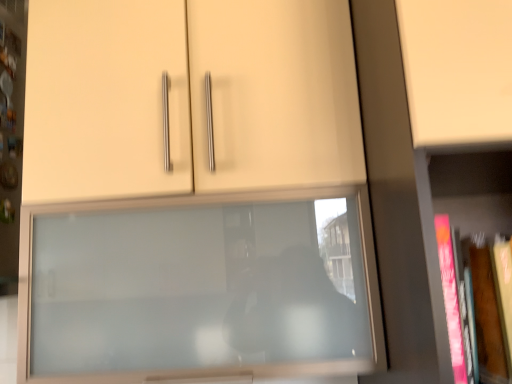
What do you see at coordinates (192, 194) in the screenshot? I see `matte glass cupboard at center` at bounding box center [192, 194].

Where is `matte glass cupboard at center`? matte glass cupboard at center is located at coordinates click(192, 194).

Considering the sizes of objects matte glass cupboard at center and pink matte book at right in the image provided, who is wider, matte glass cupboard at center or pink matte book at right?

With larger width is pink matte book at right.

From the image's perspective, is matte glass cupboard at center on pink matte book at right?

No, from the image's perspective, matte glass cupboard at center is not above pink matte book at right.

Would you say matte glass cupboard at center is outside pink matte book at right?

Yes, matte glass cupboard at center is not within pink matte book at right.

At what (x,y) coordinates should I click in order to perform the action: click on bookcase in front of the matte glass cupboard at center. Please return your answer as a coordinate pair (x, y). Image resolution: width=512 pixels, height=384 pixels. Looking at the image, I should click on (396, 200).

Considering the relative sizes of pink matte book at right and hardcover book at right in the image provided, is pink matte book at right bigger than hardcover book at right?

Correct, pink matte book at right is larger in size than hardcover book at right.

From the image's perspective, between pink matte book at right and hardcover book at right, who is located below?

hardcover book at right appears lower in the image.

From the picture: How different are the orientations of pink matte book at right and hardcover book at right in degrees?

1.17 degrees.

Is point (389, 203) farther from viewer compared to point (490, 313)?

Yes, point (389, 203) is behind point (490, 313).

From a real-world perspective, is pink matte book at right located beneath matte glass cupboard at center?

Yes, from a real-world perspective, pink matte book at right is beneath matte glass cupboard at center.

Would you say pink matte book at right is a long distance from matte glass cupboard at center?

No, pink matte book at right is in close proximity to matte glass cupboard at center.

Can you tell me how much pink matte book at right and matte glass cupboard at center differ in facing direction?

2.86 degrees separate the facing orientations of pink matte book at right and matte glass cupboard at center.

From a real-world perspective, which is physically below, hardcover book at right or pink matte book at right?

In real-world perspective, hardcover book at right is lower.

How many degrees apart are the facing directions of hardcover book at right and pink matte book at right?

1.17 degrees separate the facing orientations of hardcover book at right and pink matte book at right.

How much distance is there between hardcover book at right and pink matte book at right?

4.94 inches.

Who is shorter, hardcover book at right or pink matte book at right?

With less height is hardcover book at right.

The width and height of the screenshot is (512, 384). In order to click on cupboard to the left of hardcover book at right in this screenshot , I will do `click(192, 194)`.

Is hardcover book at right taller or shorter than matte glass cupboard at center?

In the image, hardcover book at right appears to be shorter than matte glass cupboard at center.

Looking at this image, is hardcover book at right positioned with its back to matte glass cupboard at center?

hardcover book at right is not turned away from matte glass cupboard at center.

Looking at their sizes, would you say hardcover book at right is wider or thinner than matte glass cupboard at center?

hardcover book at right is thinner than matte glass cupboard at center.

Is hardcover book at right surrounded by matte glass cupboard at center?

That's incorrect, hardcover book at right is not inside matte glass cupboard at center.

Are matte glass cupboard at center and hardcover book at right located far from each other?

No, matte glass cupboard at center is in close proximity to hardcover book at right.

Can you confirm if matte glass cupboard at center is smaller than hardcover book at right?

Incorrect, matte glass cupboard at center is not smaller in size than hardcover book at right.

Who is taller, matte glass cupboard at center or hardcover book at right?

matte glass cupboard at center.

This screenshot has height=384, width=512. I want to click on bookcase in front of the matte glass cupboard at center, so click(x=396, y=200).

Image resolution: width=512 pixels, height=384 pixels. I want to click on book below the pink matte book at right (from the image's perspective), so click(x=467, y=311).

Which object lies further to the anchor point hardcover book at right, pink matte book at right or matte glass cupboard at center?

matte glass cupboard at center is further to hardcover book at right.

Estimate the real-world distances between objects in this image. Which object is further from pink matte book at right, hardcover book at right or matte glass cupboard at center?

matte glass cupboard at center lies further to pink matte book at right than the other object.

Based on their spatial positions, is matte glass cupboard at center or pink matte book at right further from hardcover book at right?

Based on the image, matte glass cupboard at center appears to be further to hardcover book at right.

When comparing their distances from pink matte book at right, does matte glass cupboard at center or hardcover book at right seem further?

Among the two, matte glass cupboard at center is located further to pink matte book at right.

Considering their positions, is pink matte book at right positioned further to matte glass cupboard at center than hardcover book at right?

hardcover book at right.

From the image, which object appears to be farther from matte glass cupboard at center, hardcover book at right or pink matte book at right?

Among the two, hardcover book at right is located further to matte glass cupboard at center.

Locate an element on the screen. This screenshot has height=384, width=512. book between matte glass cupboard at center and pink matte book at right in the horizontal direction is located at coordinates (467, 311).